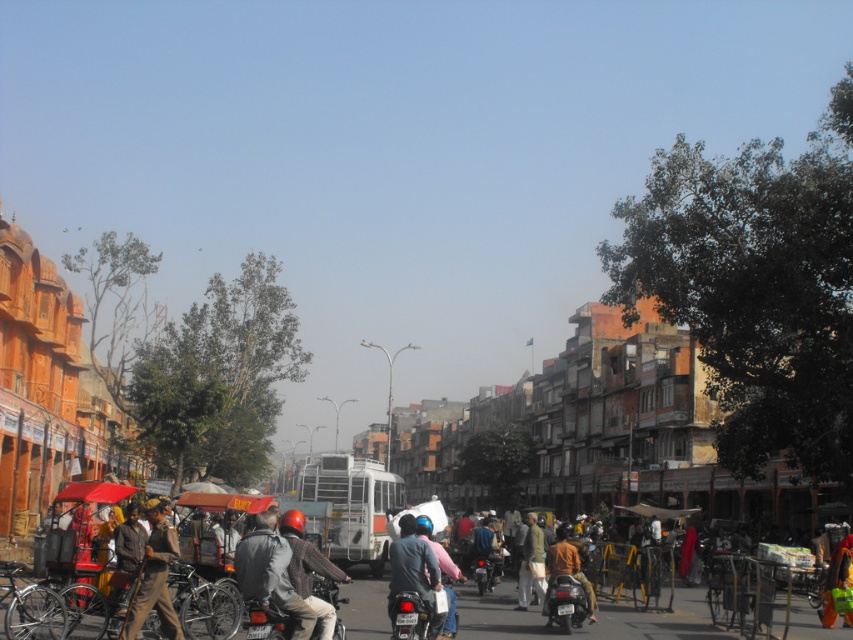
Question: Can you confirm if dark brown leather jacket at lower left is positioned to the left of knitted sweater at center?

Choices:
 (A) yes
 (B) no

Answer: (A)

Question: Based on their relative distances, which object is farther from the dark brown leather jacket at lower left?

Choices:
 (A) brown fabric bag at center
 (B) shiny metallic motorcycle at center
 (C) knitted sweater at center

Answer: (A)

Question: Which point is closer to the camera?

Choices:
 (A) metallic red motorcycle at center
 (B) brown fabric bag at center

Answer: (A)

Question: Can you confirm if gray fabric jacket at center is bigger than matte black motorcycle at center?

Choices:
 (A) no
 (B) yes

Answer: (A)

Question: Which object is the closest to the shiny metallic motorcycle at center?

Choices:
 (A) brown leather jacket at center
 (B) knitted sweater at center
 (C) silver metallic bicycle at lower left

Answer: (A)

Question: Is silver metallic bicycle at lower left bigger than brown fabric bag at center?

Choices:
 (A) no
 (B) yes

Answer: (B)